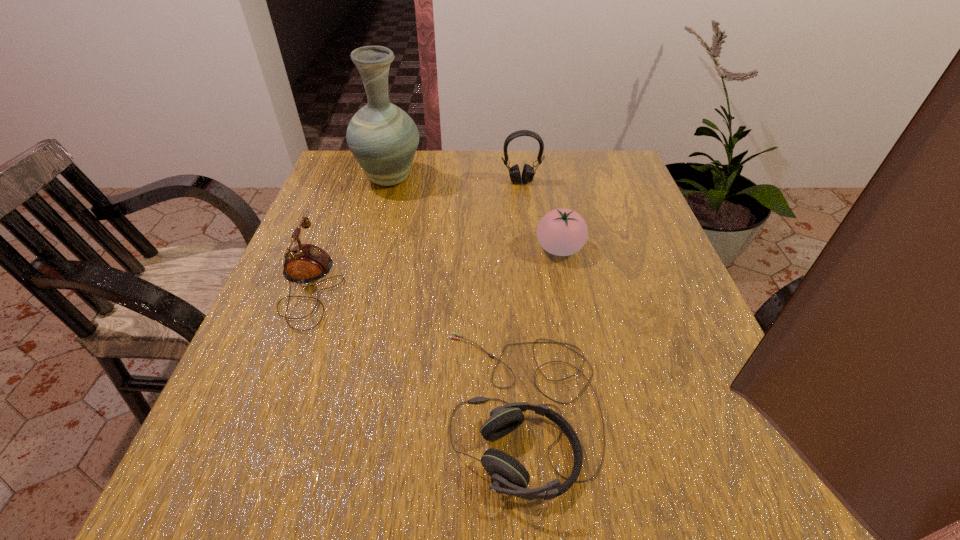
Locate an element on the screen. This screenshot has width=960, height=540. free space between the pitcher and the telephone is located at coordinates (349, 233).

The image size is (960, 540). In order to click on empty space that is in between the tomato and the farther headset in this screenshot , I will do `click(540, 215)`.

Locate an element on the screen. The width and height of the screenshot is (960, 540). unoccupied area between the telephone and the fourth shortest object is located at coordinates (416, 234).

Identify the location of free space that is in between the telephone and the farther headset. This screenshot has width=960, height=540. [x=416, y=234].

Where is `blank region between the tallest object and the telephone`? blank region between the tallest object and the telephone is located at coordinates tap(349, 233).

This screenshot has width=960, height=540. What are the coordinates of `blank region between the fourth shortest object and the nearest object` in the screenshot? It's located at (521, 295).

Choose which object is the nearest neighbor to the nearer headset. Please provide its 2D coordinates. Your answer should be formatted as a tuple, i.e. [(x, y)], where the tuple contains the x and y coordinates of a point satisfying the conditions above.

[(562, 232)]

Select which object appears as the closest to the fourth shortest object. Please provide its 2D coordinates. Your answer should be formatted as a tuple, i.e. [(x, y)], where the tuple contains the x and y coordinates of a point satisfying the conditions above.

[(562, 232)]

This screenshot has width=960, height=540. In order to click on blank space that satisfies the following two spatial constraints: 1. on the front-facing side of the farther headset; 2. on the right side of the tomato in this screenshot , I will do `click(530, 248)`.

The width and height of the screenshot is (960, 540). In order to click on vacant region that satisfies the following two spatial constraints: 1. on the front side of the tomato; 2. on the outer surface of the shorter headset in this screenshot , I will do `click(591, 408)`.